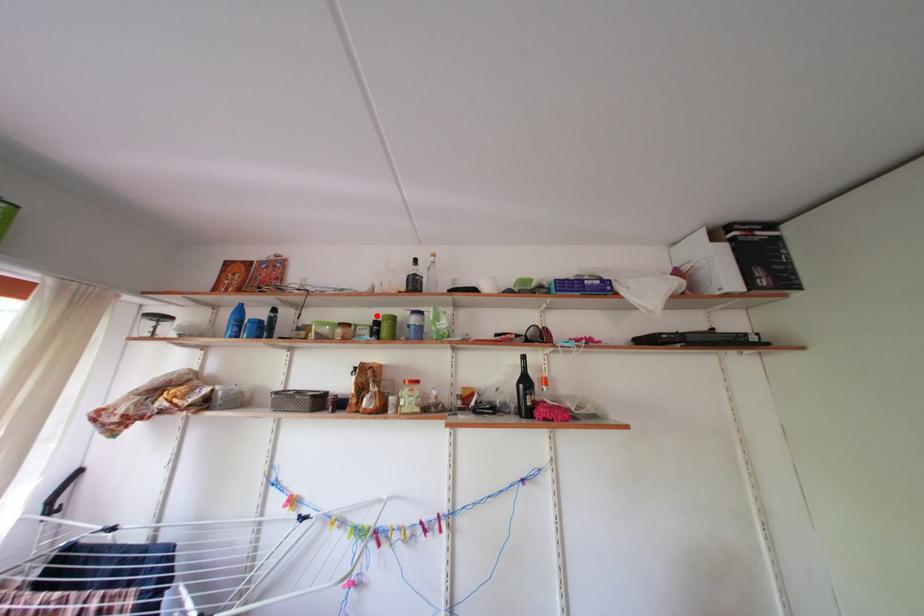
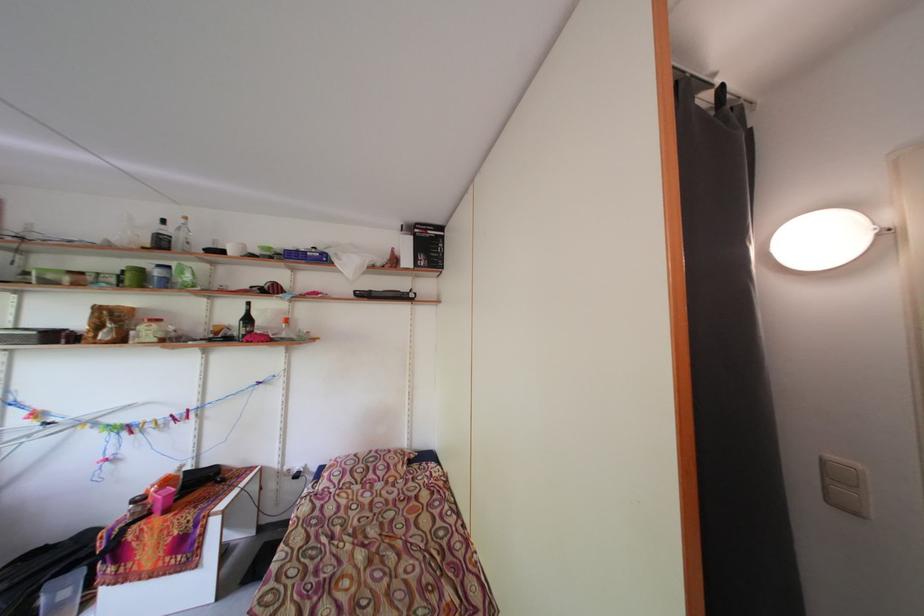
In the second image, find the point that corresponds to the highlighted location in the first image.

(127, 265)